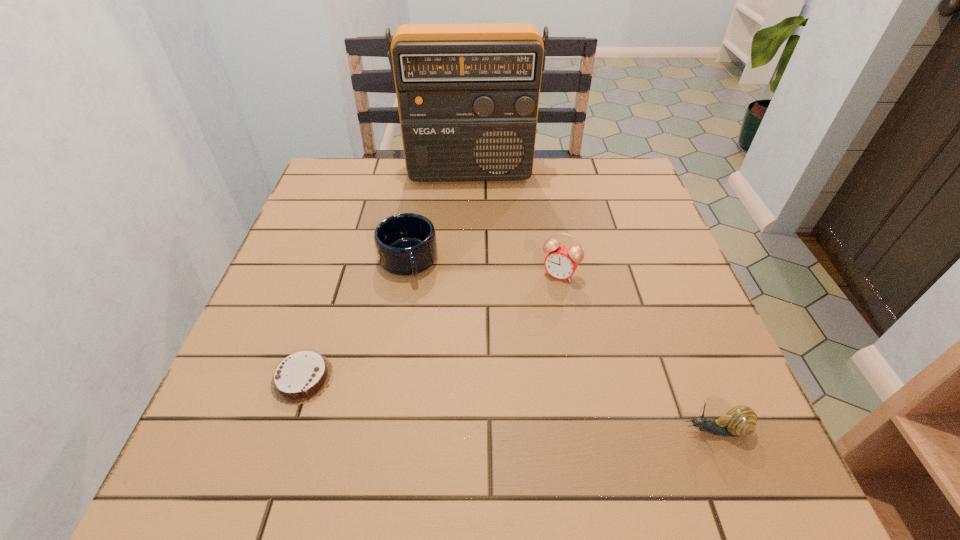
Image resolution: width=960 pixels, height=540 pixels. I want to click on free space that satisfies the following two spatial constraints: 1. on the back side of the chocolate cake; 2. on the right side of the radio receiver, so click(x=370, y=173).

At what (x,y) coordinates should I click in order to perform the action: click on free point that satisfies the following two spatial constraints: 1. on the front side of the farthest object; 2. on the front-facing side of the nearest object. Please return your answer as a coordinate pair (x, y). Looking at the image, I should click on (462, 430).